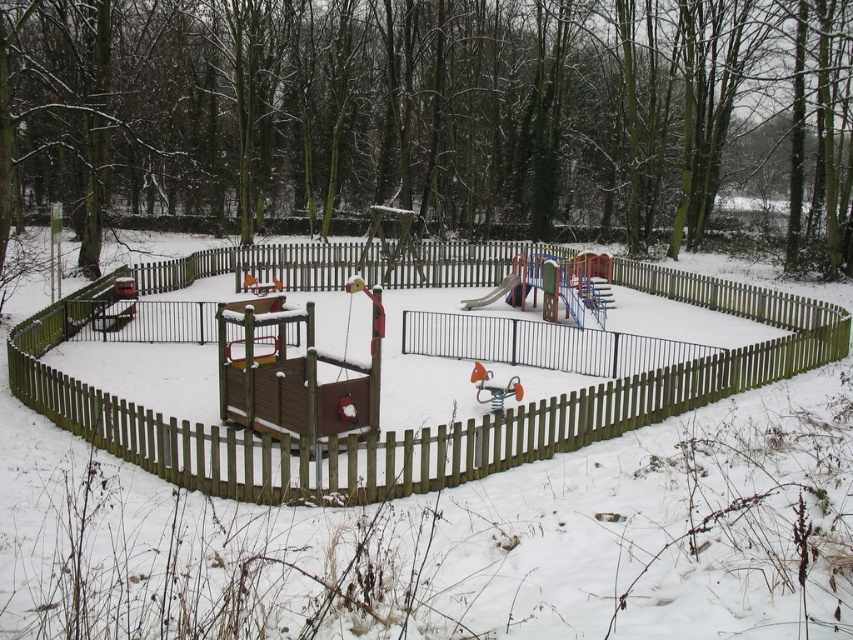
You are a child trying to see the slide from the outside of the playground. Can you see the smooth plastic slide at center through the brown wooden fence at center?

The brown wooden fence at center is positioned over smooth plastic slide at center, so the slide is blocked by the fence and cannot be seen through it.

You are a child trying to throw a snowball through the gap between the brown wooden fence at center and the smooth plastic slide at center. Can you fit the snowball through the gap?

The brown wooden fence at center is wider than the smooth plastic slide at center, so the gap between them is narrower than the slide. However, since the snowball size isn not specified, it might be possible if the snowball is small enough to fit through the narrower gap.

Based on the photo, you are a parent trying to ensure your child stays within the playground. You notice the brown wooden fence at center and the smooth plastic slide at center. Which structure is taller and can provide better visibility to monitor your child?

The brown wooden fence at center is taller than the smooth plastic slide at center, so it provides better visibility to monitor your child.